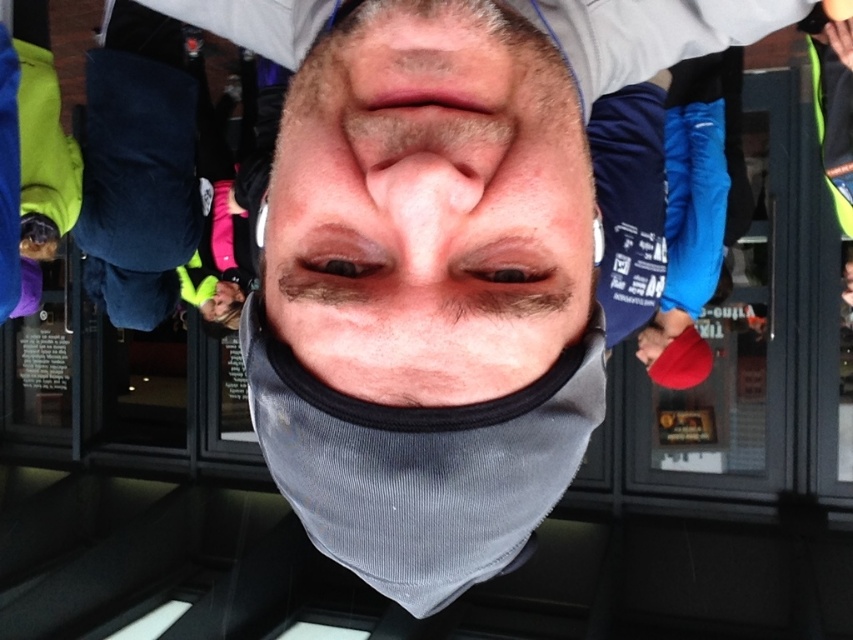
Consider the image. Does gray fabric face at center have a greater width compared to smooth flesh nose at center?

Indeed, gray fabric face at center has a greater width compared to smooth flesh nose at center.

Between point (409, 28) and point (393, 170), which one is positioned in front?

Point (393, 170) is more forward.

The width and height of the screenshot is (853, 640). I want to click on gray fabric face at center, so click(424, 193).

Does gray fabric face at center have a lesser width compared to pink flesh-colored nose at center?

No.

Does gray fabric face at center appear under pink flesh-colored nose at center?

Yes, gray fabric face at center is below pink flesh-colored nose at center.

The image size is (853, 640). What are the coordinates of `gray fabric face at center` in the screenshot? It's located at (424, 193).

Can you confirm if smooth flesh nose at center is shorter than pink flesh-colored nose at center?

Correct, smooth flesh nose at center is not as tall as pink flesh-colored nose at center.

Which is in front, point (463, 182) or point (460, 205)?

Point (463, 182) is in front.

The width and height of the screenshot is (853, 640). Find the location of `smooth flesh nose at center`. smooth flesh nose at center is located at coordinates (426, 173).